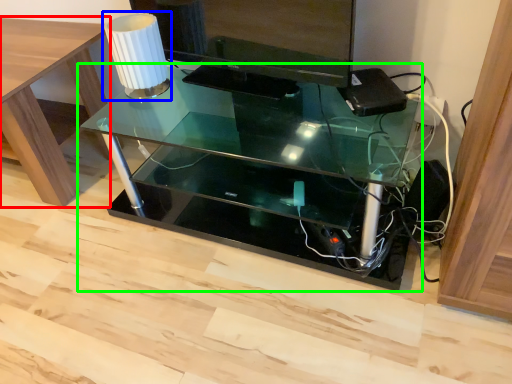
Question: Estimate the real-world distances between objects in this image. Which object is farther from table (highlighted by a red box), table lamp (highlighted by a blue box) or table (highlighted by a green box)?

Choices:
 (A) table lamp
 (B) table

Answer: (B)